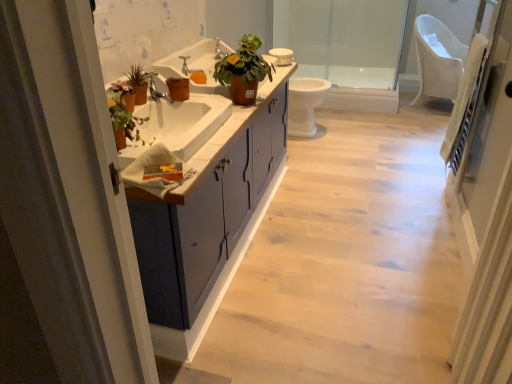
Question: Would you say matte white cabinet at center contains white glossy toilet at center?

Choices:
 (A) yes
 (B) no

Answer: (B)

Question: Is matte white cabinet at center outside of white glossy toilet at center?

Choices:
 (A) no
 (B) yes

Answer: (B)

Question: From the image's perspective, is matte white cabinet at center located above white glossy toilet at center?

Choices:
 (A) no
 (B) yes

Answer: (A)

Question: Can you confirm if matte white cabinet at center is shorter than white glossy toilet at center?

Choices:
 (A) no
 (B) yes

Answer: (A)

Question: Does matte white cabinet at center lie in front of white glossy toilet at center?

Choices:
 (A) no
 (B) yes

Answer: (B)

Question: Considering the positions of matte white cabinet at center and matte silver faucet at upper center in the image, is matte white cabinet at center bigger or smaller than matte silver faucet at upper center?

Choices:
 (A) small
 (B) big

Answer: (B)

Question: Considering the positions of matte white cabinet at center and matte silver faucet at upper center in the image, is matte white cabinet at center taller or shorter than matte silver faucet at upper center?

Choices:
 (A) tall
 (B) short

Answer: (A)

Question: From the image's perspective, is matte white cabinet at center positioned above or below matte silver faucet at upper center?

Choices:
 (A) below
 (B) above

Answer: (A)

Question: Considering the relative positions of matte white cabinet at center and matte silver faucet at upper center in the image provided, is matte white cabinet at center to the left or to the right of matte silver faucet at upper center?

Choices:
 (A) right
 (B) left

Answer: (A)

Question: Is matte gray cabinet at center taller or shorter than matte silver faucet at upper center?

Choices:
 (A) tall
 (B) short

Answer: (A)

Question: Is point (203, 185) closer or farther from the camera than point (187, 69)?

Choices:
 (A) closer
 (B) farther

Answer: (A)

Question: From the image's perspective, is matte gray cabinet at center located above or below matte silver faucet at upper center?

Choices:
 (A) above
 (B) below

Answer: (B)

Question: From a real-world perspective, is matte gray cabinet at center above or below matte silver faucet at upper center?

Choices:
 (A) above
 (B) below

Answer: (B)

Question: Looking at their shapes, would you say white glossy toilet at center is wider or thinner than matte terracotta pot at center?

Choices:
 (A) thin
 (B) wide

Answer: (B)

Question: From their relative heights in the image, would you say white glossy toilet at center is taller or shorter than matte terracotta pot at center?

Choices:
 (A) short
 (B) tall

Answer: (B)